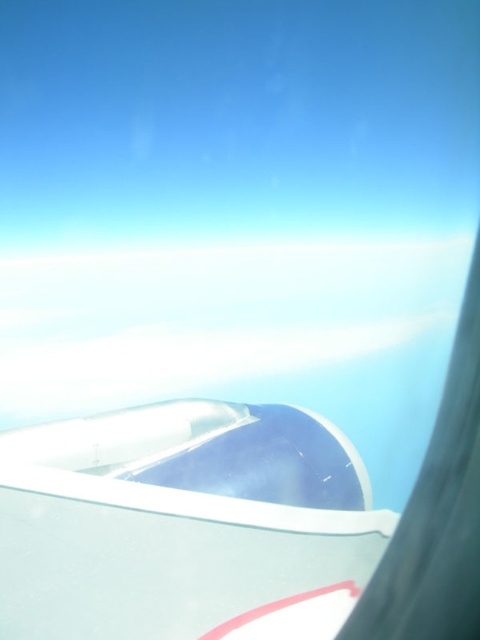
You are a passenger seated in the airplane and looking out the window. You notice two points marked in the scene. Which point, point (x=394, y=516) or point (x=167, y=365), appears closer to you?

Point (x=394, y=516) is closer to the camera than point (x=167, y=365).

You are a flight attendant looking out the airplane window. You notice the white glossy airplane wing at upper center and the white fluffy cloud at upper center. Which object appears shorter in height?

The white glossy airplane wing at upper center is not as tall as the white fluffy cloud at upper center, so the airplane wing appears shorter in height.

You are a flight attendant on an airplane. You notice through the window that the white glossy airplane wing at upper center and the white fluffy cloud at upper center are both in view. Which object appears wider in the window?

The white fluffy cloud at upper center appears wider than the white glossy airplane wing at upper center because the wing is narrower than the cloud.